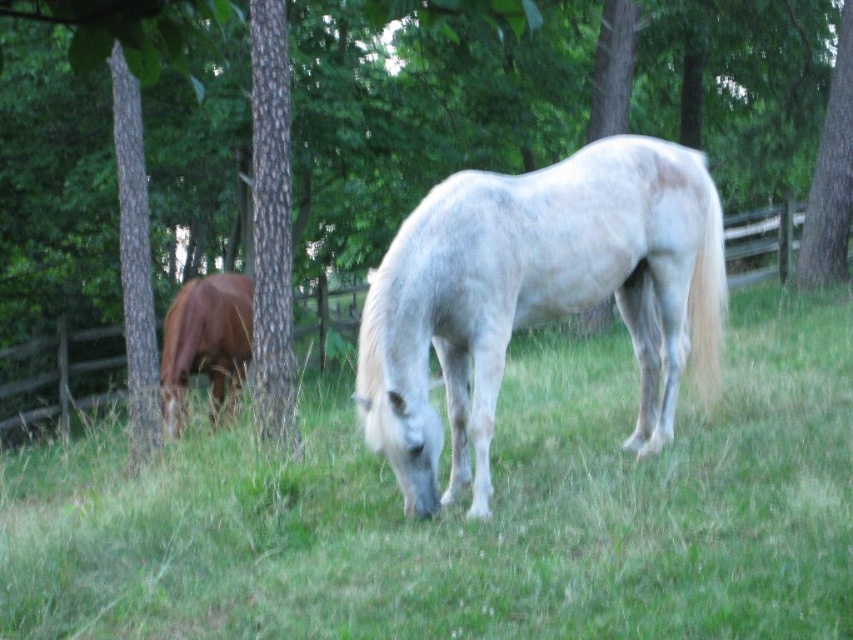
You are standing at the center of the field and see two points marked in the image. Which point is closer to you, point (258,413) or point (173,326)?

Point (258,413) is in front of point (173,326), so it is closer to you.

You are a farmer checking the field where the green grass at center and smooth bark tree at center right are located. Which object is closer to the wooden fence enclosing the field?

The green grass at center is closer to the wooden fence because it is positioned to the left of the smooth bark tree at center right, which would be further away from the fence if the fence is on the left side of the scene.